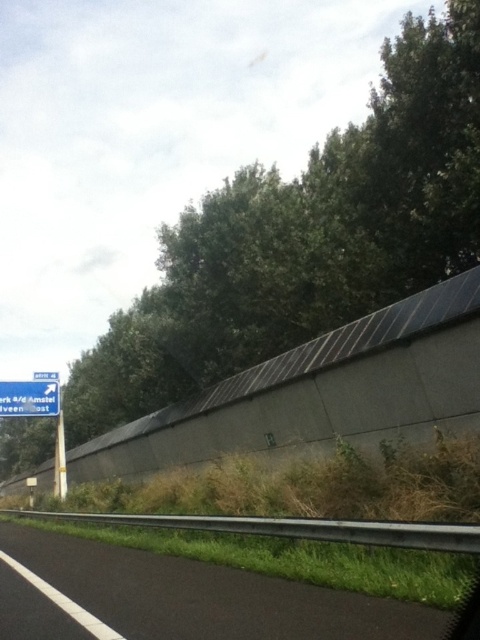
Question: Does black asphalt highway at lower left have a greater width compared to blue plastic sign at left?

Choices:
 (A) yes
 (B) no

Answer: (A)

Question: Which point is closer to the camera?

Choices:
 (A) blue plastic sign at left
 (B) black asphalt highway at lower left

Answer: (B)

Question: Does black asphalt highway at lower left appear on the right side of blue plastic sign at left?

Choices:
 (A) no
 (B) yes

Answer: (B)

Question: Among these points, which one is farthest from the camera?

Choices:
 (A) (109, 611)
 (B) (25, 390)

Answer: (B)

Question: Can you confirm if black asphalt highway at lower left is positioned above blue plastic sign at left?

Choices:
 (A) yes
 (B) no

Answer: (B)